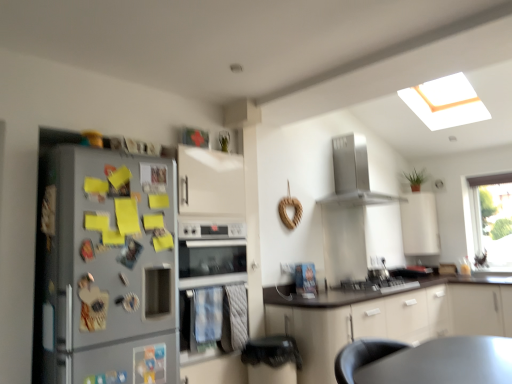
Question: Is silver metallic refrigerator at left in front of satin silver range hood at upper center?

Choices:
 (A) no
 (B) yes

Answer: (B)

Question: From a real-world perspective, is silver metallic refrigerator at left under satin silver range hood at upper center?

Choices:
 (A) no
 (B) yes

Answer: (B)

Question: From the image's perspective, does silver metallic refrigerator at left appear lower than satin silver range hood at upper center?

Choices:
 (A) no
 (B) yes

Answer: (B)

Question: From the image's perspective, does silver metallic refrigerator at left appear higher than satin silver range hood at upper center?

Choices:
 (A) yes
 (B) no

Answer: (B)

Question: Is silver metallic refrigerator at left far from satin silver range hood at upper center?

Choices:
 (A) no
 (B) yes

Answer: (B)

Question: Is silver metallic refrigerator at left shorter than satin silver range hood at upper center?

Choices:
 (A) yes
 (B) no

Answer: (B)

Question: From the image's perspective, does silver metallic oven at center appear lower than transparent glass window at upper right?

Choices:
 (A) yes
 (B) no

Answer: (A)

Question: Does silver metallic oven at center lie behind transparent glass window at upper right?

Choices:
 (A) no
 (B) yes

Answer: (A)

Question: From a real-world perspective, is silver metallic oven at center on top of transparent glass window at upper right?

Choices:
 (A) no
 (B) yes

Answer: (A)

Question: From the image's perspective, is silver metallic oven at center over transparent glass window at upper right?

Choices:
 (A) yes
 (B) no

Answer: (B)

Question: Can you confirm if silver metallic oven at center is positioned to the right of transparent glass window at upper right?

Choices:
 (A) no
 (B) yes

Answer: (A)

Question: Can transparent glass window at upper right be found inside silver metallic oven at center?

Choices:
 (A) yes
 (B) no

Answer: (B)

Question: Is silver metallic oven at center at the left side of satin silver gas stove at center?

Choices:
 (A) yes
 (B) no

Answer: (A)